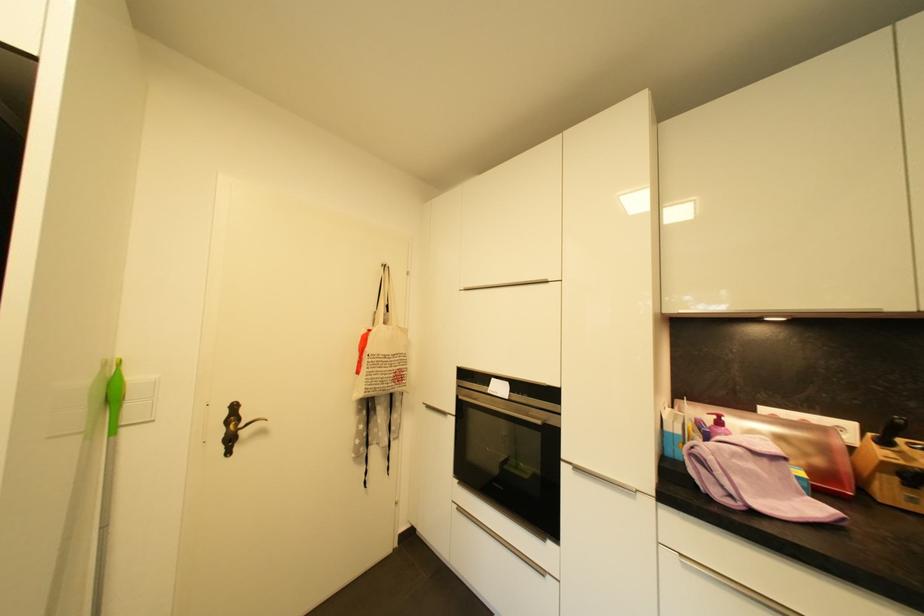
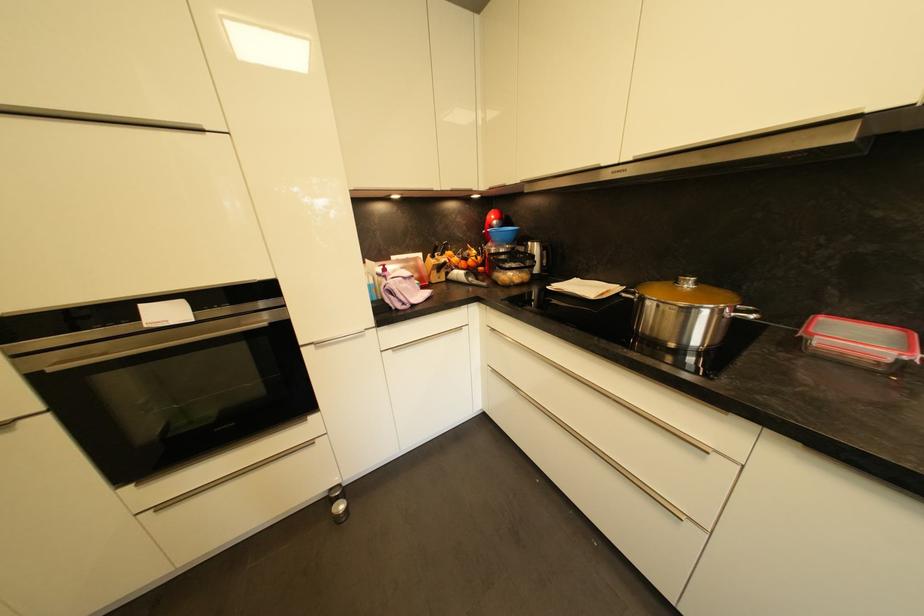
Find the pixel in the second image that matches the point at 479,419 in the first image.

(124, 384)